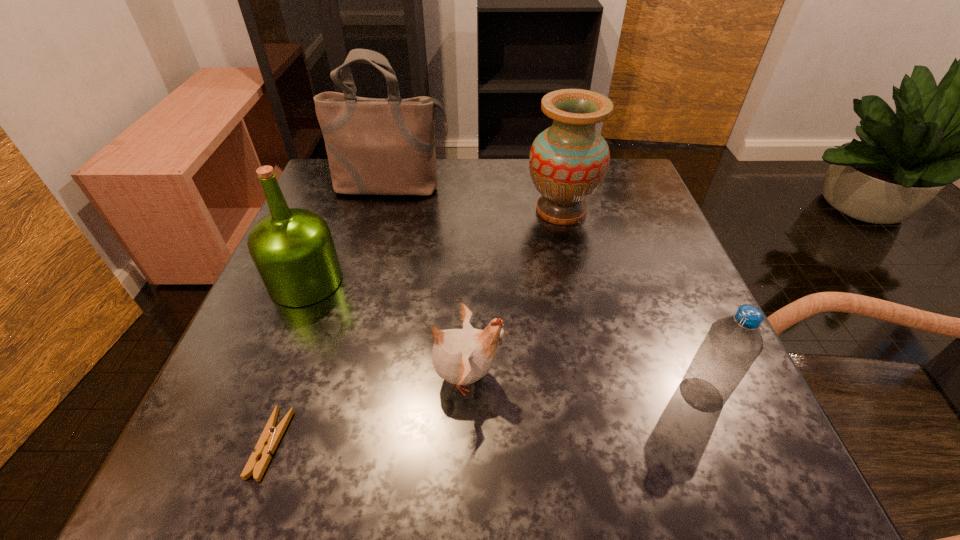
Find the location of a particular element. the tallest object is located at coordinates (374, 146).

Identify the location of the fifth object from left to right. This screenshot has height=540, width=960. (568, 162).

You are a GUI agent. You are given a task and a screenshot of the screen. Output one action in this format:
    pyautogui.click(x=<x>, y=<y>)
    Task: Click on the olive oil
    
    Given the screenshot: What is the action you would take?
    pyautogui.click(x=292, y=248)

You are a GUI agent. You are given a task and a screenshot of the screen. Output one action in this format:
    pyautogui.click(x=<x>, y=<y>)
    Task: Click on the rightmost object
    The image size is (960, 540).
    Given the screenshot: What is the action you would take?
    pyautogui.click(x=732, y=344)

Locate an element on the screen. This screenshot has height=540, width=960. the fourth tallest object is located at coordinates (732, 344).

I want to click on the second shortest object, so click(463, 356).

Find the location of a particular element. Image resolution: width=960 pixels, height=540 pixels. clothespin is located at coordinates (271, 435).

Locate an element on the screen. The height and width of the screenshot is (540, 960). vacant space located on the front-facing side of the shoulder bag is located at coordinates (362, 304).

I want to click on vacant area located 0.200m on the front of the fifth object from left to right, so click(581, 300).

The height and width of the screenshot is (540, 960). Find the location of `free location located 0.350m on the back of the fourth nearest object`. free location located 0.350m on the back of the fourth nearest object is located at coordinates (351, 170).